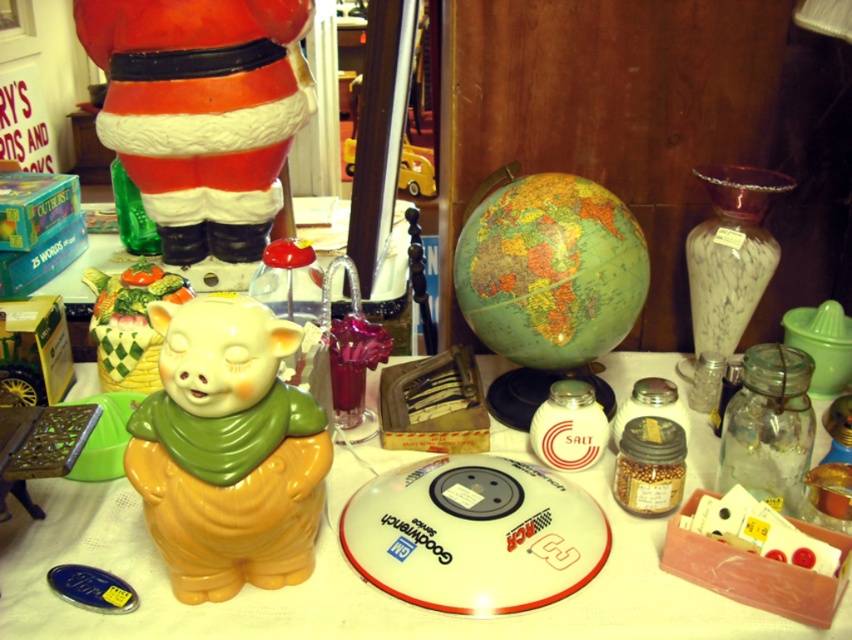
You are standing in front of the table at the flea market and want to pick up both items located at point (275, 122) and point (127, 356). Which item should you pick up first to minimize walking distance?

You should pick up the item at point (275, 122) first because it is closer to you than the item at point (127, 356).

You are setting up a display for a holiday sale and need to place the matte ceramic piggy bank at lower left and the red glossy santa at upper left. The store requires that these two items must be at least 20 inches apart. Can you confirm if the current placement meets this requirement?

The matte ceramic piggy bank at lower left is 24.37 inches from the red glossy santa at upper left, which exceeds the 20 inch minimum requirement. The current placement meets the store requirement.